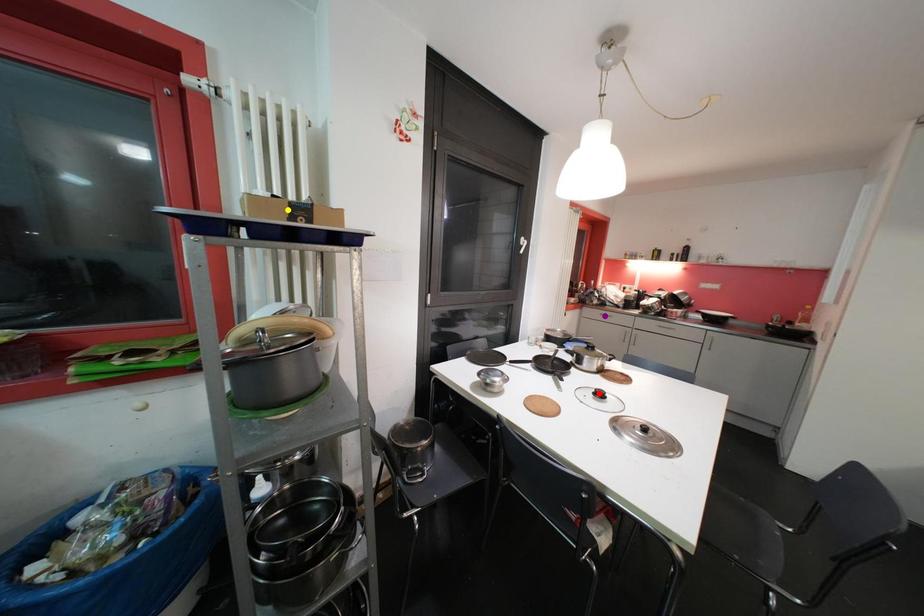
Order these from nearest to farthest:
yellow point
purple point
red point

yellow point
red point
purple point